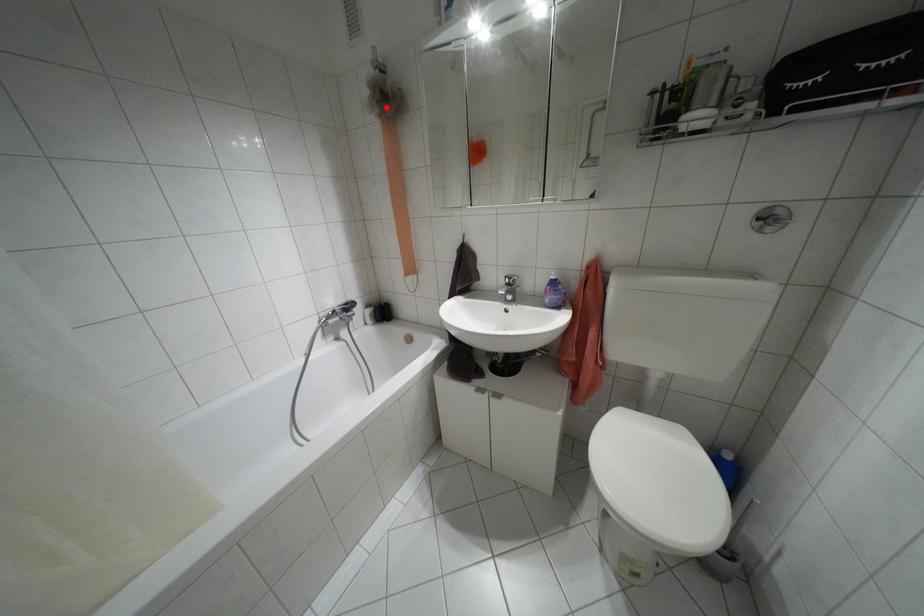
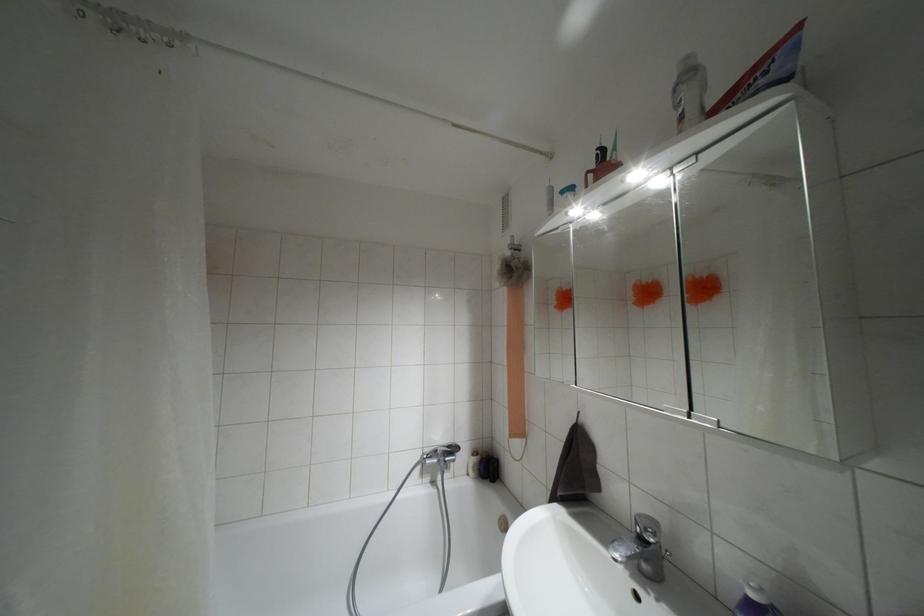
Locate, in the second image, the point that corresponds to the highlighted location in the first image.

(509, 277)